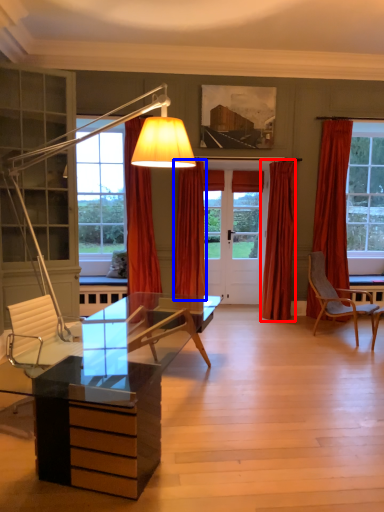
Question: Which of the following is the closest to the observer, curtain (highlighted by a red box) or curtain (highlighted by a blue box)?

Choices:
 (A) curtain
 (B) curtain

Answer: (B)